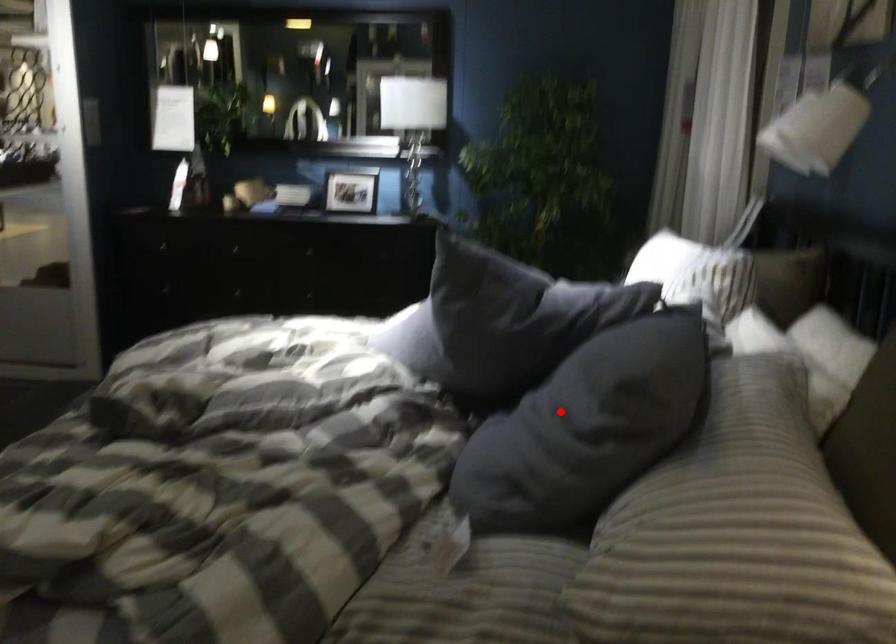
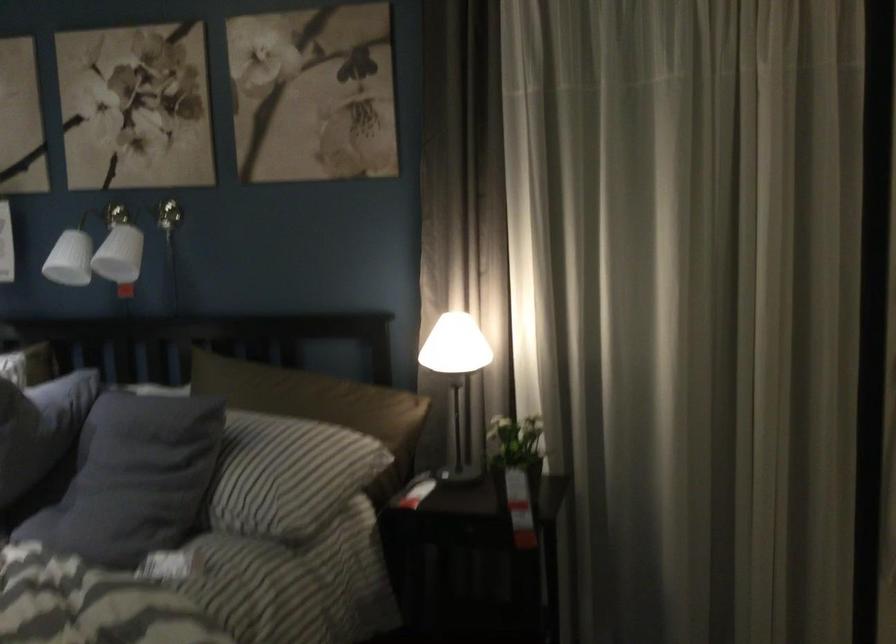
In the second image, find the point that corresponds to the highlighted location in the first image.

(131, 473)